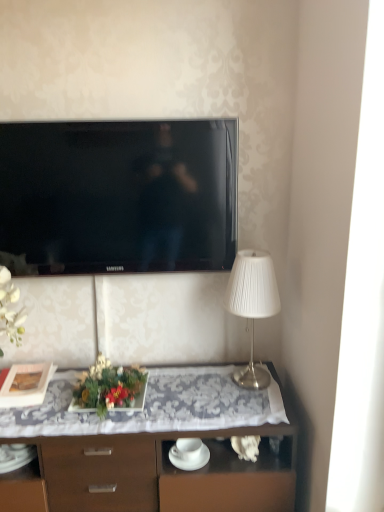
The width and height of the screenshot is (384, 512). I want to click on free space between white pleated fabric lampshade at right and green leafy plant at center, so click(x=188, y=391).